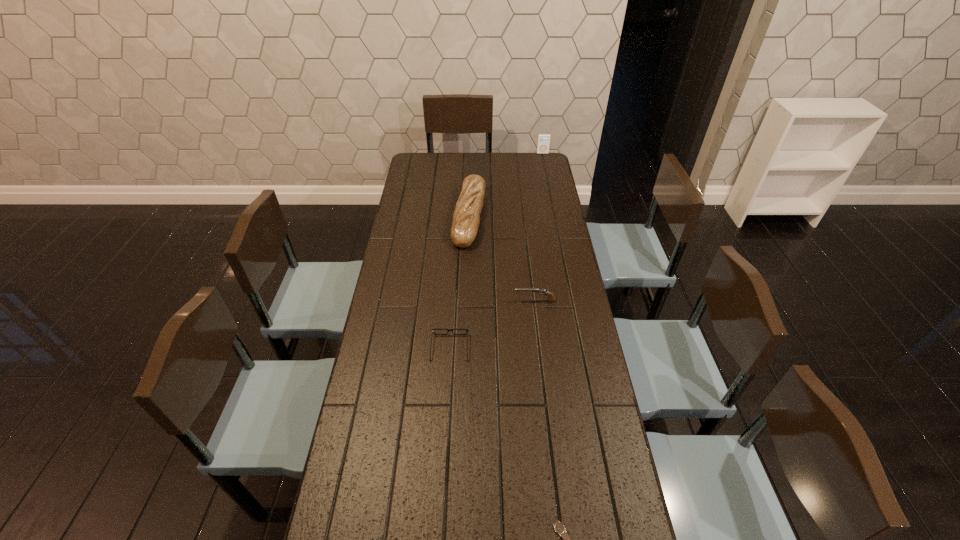
Locate an element on the screen. This screenshot has width=960, height=540. free space at the left edge is located at coordinates (393, 386).

I want to click on vacant space at the right edge, so click(x=538, y=225).

The height and width of the screenshot is (540, 960). I want to click on free point between the baguet and the third nearest object, so click(x=502, y=259).

The height and width of the screenshot is (540, 960). Identify the location of free spot between the fourth tallest object and the rightmost object. (496, 251).

Where is `free spot between the fourth nearest object and the second nearest object`? free spot between the fourth nearest object and the second nearest object is located at coordinates (460, 282).

The image size is (960, 540). What are the coordinates of `free space that is in between the second nearest object and the rightmost object` in the screenshot? It's located at (496, 251).

Where is `vacant area that lies between the gun and the fourth tallest object`? The image size is (960, 540). vacant area that lies between the gun and the fourth tallest object is located at coordinates (492, 324).

Locate an element on the screen. The image size is (960, 540). unoccupied area between the second nearest object and the rightmost object is located at coordinates (496, 251).

Identify the location of free space between the farthest object and the fourth farthest object. (496, 251).

Locate an element on the screen. This screenshot has height=540, width=960. free space between the baguet and the third tallest object is located at coordinates (502, 259).